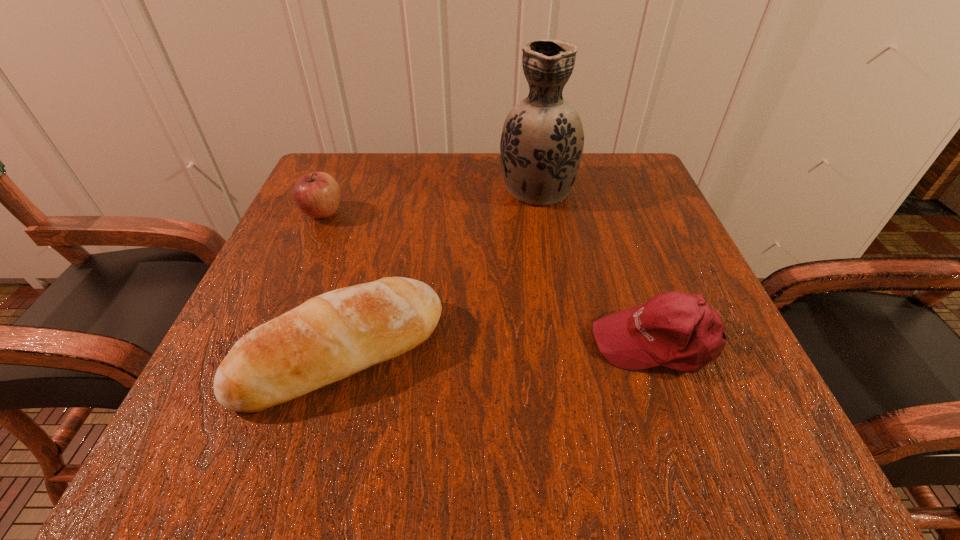
At what (x,y) coordinates should I click in order to perform the action: click on free point between the baseball cap and the apple. Please return your answer as a coordinate pair (x, y). The width and height of the screenshot is (960, 540). Looking at the image, I should click on (491, 278).

Find the location of `vacant area between the bread and the apple`. vacant area between the bread and the apple is located at coordinates (x=332, y=283).

The image size is (960, 540). Identify the location of empty location between the baseball cap and the tallest object. coord(597,265).

You are a GUI agent. You are given a task and a screenshot of the screen. Output one action in this format:
    pyautogui.click(x=<x>, y=<y>)
    Task: Click on the blank region between the apple and the bread
    The width and height of the screenshot is (960, 540).
    Given the screenshot: What is the action you would take?
    pyautogui.click(x=332, y=283)

The width and height of the screenshot is (960, 540). I want to click on vacant space in between the baseball cap and the apple, so click(491, 278).

Select which object appears as the closest to the vase. Please provide its 2D coordinates. Your answer should be formatted as a tuple, i.e. [(x, y)], where the tuple contains the x and y coordinates of a point satisfying the conditions above.

[(679, 331)]

Locate which object is the third closest to the tallest object. Please provide its 2D coordinates. Your answer should be formatted as a tuple, i.e. [(x, y)], where the tuple contains the x and y coordinates of a point satisfying the conditions above.

[(318, 195)]

Image resolution: width=960 pixels, height=540 pixels. I want to click on blank area in the image that satisfies the following two spatial constraints: 1. on the front side of the bread; 2. on the right side of the apple, so click(x=263, y=353).